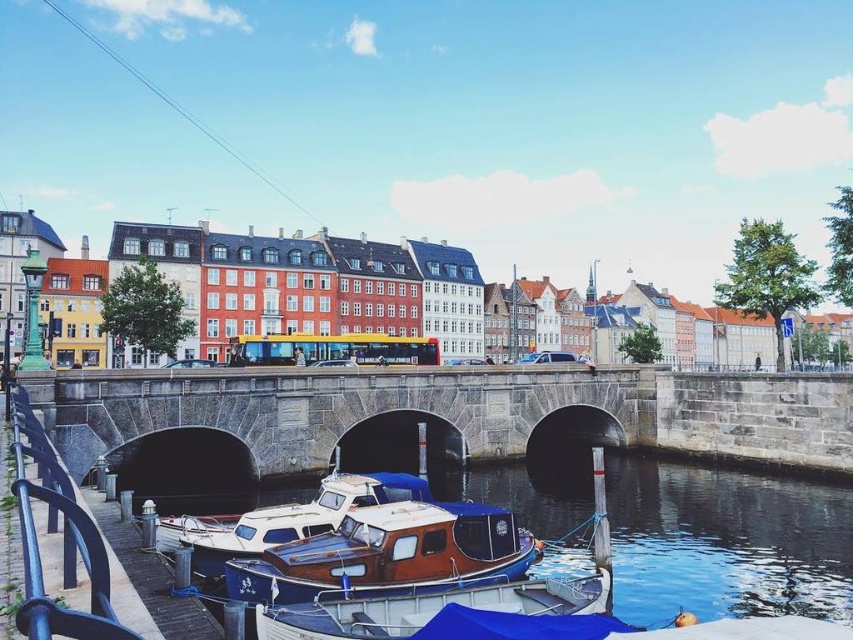
You are a tourist standing on the wooden polished boat at lower center and want to cross under the gray stone bridge at center. Is the boat able to pass under the bridge without any issues?

The gray stone bridge at center is above the wooden polished boat at lower center, so the boat can pass under the bridge as there is sufficient clearance between them.